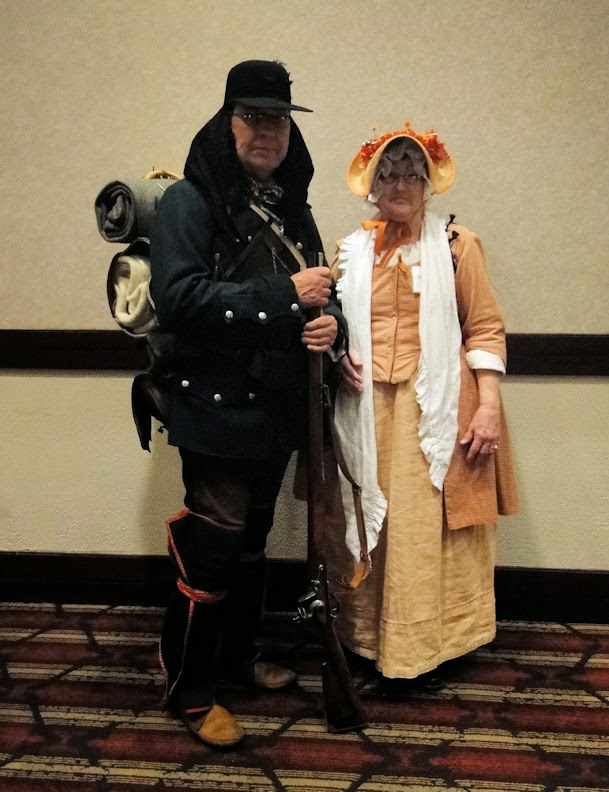
Identify the location of wall baseboard. (38, 573), (153, 579), (284, 581), (526, 594), (582, 600).